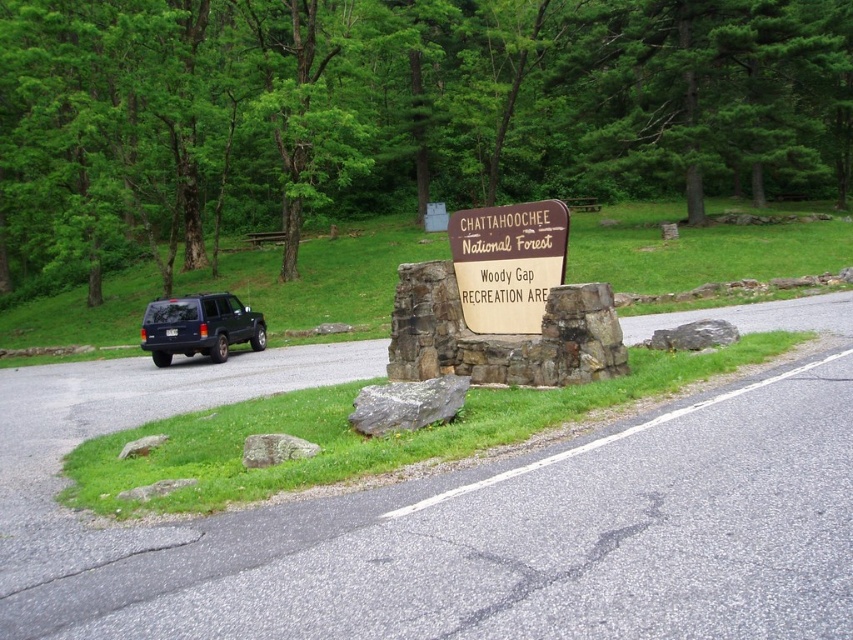
In the scene shown: You are standing at the Woody Gap Recreation Area and want to locate the brown wooden sign at center. According to the map coordinates, there is a point at (508,262). Can you confirm if this point is on the brown wooden sign at center?

Yes, the point at (508,262) is on the brown wooden sign at center as stated in the description.

You are a hiker who wants to place a small flag on the smaller gray rock between the gray rock at lower center and the gray rock at lower left. Which gray rock should you choose?

The gray rock at lower center is smaller than the gray rock at lower left, so you should choose the gray rock at lower center to place the small flag.

You are a hiker standing at the base of the signpost in the Woody Gap Recreation Area. You notice two gray rocks nearby. One is labeled as the gray rock at lower center and the other as the gray rock at lower left. From your vantage point, which gray rock appears higher up in the scene?

The gray rock at lower center is located above the gray rock at lower left, so from your vantage point, the gray rock at lower center appears higher up in the scene.